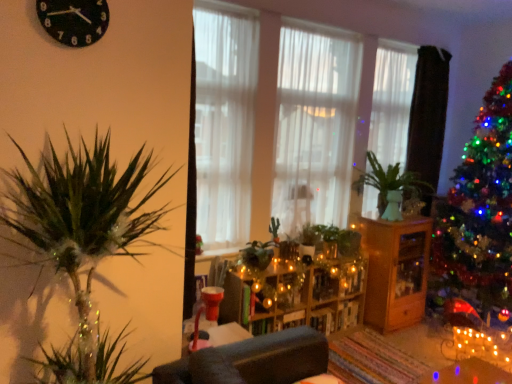
Question: Is wooden cabinet at center looking in the opposite direction of transparent glass vase at center-right?

Choices:
 (A) yes
 (B) no

Answer: (B)

Question: Would you say wooden cabinet at center contains transparent glass vase at center-right?

Choices:
 (A) no
 (B) yes

Answer: (A)

Question: Is wooden cabinet at center smaller than transparent glass vase at center-right?

Choices:
 (A) no
 (B) yes

Answer: (A)

Question: Is wooden cabinet at center touching transparent glass vase at center-right?

Choices:
 (A) no
 (B) yes

Answer: (A)

Question: From the image's perspective, is wooden cabinet at center under transparent glass vase at center-right?

Choices:
 (A) yes
 (B) no

Answer: (A)

Question: From a real-world perspective, relative to transparent glass vase at center-right, is white sheer curtain at center, acting as the first curtain starting from the left, vertically above or below?

Choices:
 (A) above
 (B) below

Answer: (A)

Question: Considering their positions, is white sheer curtain at center, acting as the first curtain starting from the left, located in front of or behind transparent glass vase at center-right?

Choices:
 (A) behind
 (B) front

Answer: (B)

Question: Is white sheer curtain at center, which ranks as the third curtain in right-to-left order, spatially inside transparent glass vase at center-right, or outside of it?

Choices:
 (A) inside
 (B) outside

Answer: (B)

Question: From the image's perspective, is white sheer curtain at center, acting as the first curtain starting from the left, above or below transparent glass vase at center-right?

Choices:
 (A) above
 (B) below

Answer: (A)

Question: From a real-world perspective, is white sheer curtain at center, which is the third curtain from left to right, positioned above or below wooden cabinet at center?

Choices:
 (A) above
 (B) below

Answer: (A)

Question: Is white sheer curtain at center, the first curtain viewed from the right, bigger or smaller than wooden cabinet at center?

Choices:
 (A) big
 (B) small

Answer: (B)

Question: Is point (399, 147) closer or farther from the camera than point (384, 317)?

Choices:
 (A) farther
 (B) closer

Answer: (A)

Question: From their relative heights in the image, would you say white sheer curtain at center, which is the third curtain from left to right, is taller or shorter than wooden cabinet at center?

Choices:
 (A) short
 (B) tall

Answer: (B)

Question: Considering the positions of black plastic clock at upper left and wooden shelves at center in the image, is black plastic clock at upper left taller or shorter than wooden shelves at center?

Choices:
 (A) tall
 (B) short

Answer: (B)

Question: In terms of width, does black plastic clock at upper left look wider or thinner when compared to wooden shelves at center?

Choices:
 (A) thin
 (B) wide

Answer: (A)